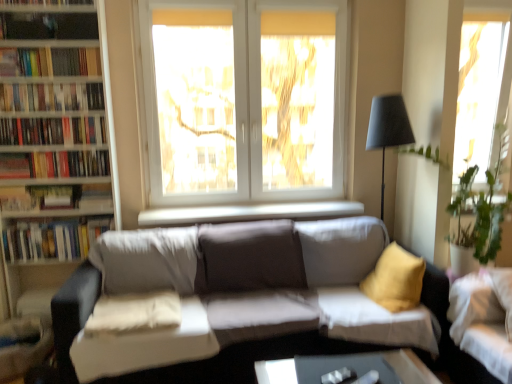
In the scene shown: What is the approximate height of hardcover books at left, which is the fourth book from top to bottom?

The height of hardcover books at left, which is the fourth book from top to bottom, is 7.80 inches.

This screenshot has height=384, width=512. What are the coordinates of `hardcover books at left, positioned as the second book in bottom-to-top order` in the screenshot? It's located at (55, 164).

What do you see at coordinates (237, 305) in the screenshot? I see `light gray fabric couch at center, which appears as the 1th studio couch when viewed from the left` at bounding box center [237, 305].

You are a GUI agent. You are given a task and a screenshot of the screen. Output one action in this format:
    pyautogui.click(x=<x>, y=<y>)
    Task: Click on the light gray fabric couch at center, which appears as the 1th studio couch when viewed from the left
    The width and height of the screenshot is (512, 384).
    Given the screenshot: What is the action you would take?
    pyautogui.click(x=237, y=305)

What do you see at coordinates (52, 151) in the screenshot? I see `white wooden bookcase at left` at bounding box center [52, 151].

Locate an element on the screen. This screenshot has width=512, height=384. hardcover books at left, which is the 2th book in top-to-bottom order is located at coordinates (51, 97).

Find the location of `hardcover books at left, positioned as the second book in bottom-to-top order`. hardcover books at left, positioned as the second book in bottom-to-top order is located at coordinates (55, 164).

Which is further, (213, 210) or (53, 121)?

The point (213, 210) is farther from the camera.

Image resolution: width=512 pixels, height=384 pixels. I want to click on window sill below the hardcover books at left, marked as the 3th book in a top-to-bottom arrangement (from a real-world perspective), so click(x=248, y=213).

Can you confirm if white smooth window sill at center is smaller than hardcover books at left, marked as the 3th book in a top-to-bottom arrangement?

Yes, white smooth window sill at center is smaller than hardcover books at left, marked as the 3th book in a top-to-bottom arrangement.

Is white smooth window sill at center closer to the viewer compared to hardcover books at left, marked as the 3th book in a top-to-bottom arrangement?

No, white smooth window sill at center is further to the viewer.

Which of these two, hardcover books at left, marked as the 3th book in a top-to-bottom arrangement, or hardcover book at left, the 5th book positioned from the top, is wider?

Wider between the two is hardcover book at left, the 5th book positioned from the top.

From the hardcover books at left, marked as the 3th book in a top-to-bottom arrangement, count 2nd books backward and point to it. Please provide its 2D coordinates.

[(52, 239)]

Considering the relative positions of hardcover books at left, the 3th book when ordered from bottom to top, and hardcover book at left, the 5th book positioned from the top, in the image provided, is hardcover books at left, the 3th book when ordered from bottom to top, to the left of hardcover book at left, the 5th book positioned from the top, from the viewer's perspective?

Correct, you'll find hardcover books at left, the 3th book when ordered from bottom to top, to the left of hardcover book at left, the 5th book positioned from the top.

Based on the photo, is hardcover books at left, marked as the 3th book in a top-to-bottom arrangement, positioned with its back to hardcover book at left, the 5th book positioned from the top?

hardcover books at left, marked as the 3th book in a top-to-bottom arrangement, does not have its back to hardcover book at left, the 5th book positioned from the top.

From a real-world perspective, does hardcover books at left, which is the 2th book in top-to-bottom order, stand above white smooth window sill at center?

Yes, from a real-world perspective, hardcover books at left, which is the 2th book in top-to-bottom order, is on top of white smooth window sill at center.

Does hardcover books at left, which is the 2th book in top-to-bottom order, have a greater height compared to white smooth window sill at center?

Indeed, hardcover books at left, which is the 2th book in top-to-bottom order, has a greater height compared to white smooth window sill at center.

How many degrees apart are the facing directions of hardcover books at left, the 4th book positioned from the bottom, and white smooth window sill at center?

hardcover books at left, the 4th book positioned from the bottom, and white smooth window sill at center are facing 1.32 degrees away from each other.

How distant is hardcover books at left, the 4th book positioned from the bottom, from white smooth window sill at center?

hardcover books at left, the 4th book positioned from the bottom, and white smooth window sill at center are 3.74 feet apart.

In the scene shown: Is light gray fabric couch at center, which is counted as the second studio couch, starting from the right, taller or shorter than hardcover book at left, marked as the first book in a bottom-to-top arrangement?

light gray fabric couch at center, which is counted as the second studio couch, starting from the right, is taller than hardcover book at left, marked as the first book in a bottom-to-top arrangement.

How many degrees apart are the facing directions of light gray fabric couch at center, which appears as the 1th studio couch when viewed from the left, and hardcover book at left, the 5th book positioned from the top?

0.681 degrees.

Is light gray fabric couch at center, which is counted as the second studio couch, starting from the right, inside the boundaries of hardcover book at left, the 5th book positioned from the top, or outside?

light gray fabric couch at center, which is counted as the second studio couch, starting from the right, is spatially situated outside hardcover book at left, the 5th book positioned from the top.

From the image's perspective, does light gray fabric couch at center, which is counted as the second studio couch, starting from the right, appear lower than hardcover book at left, the 5th book positioned from the top?

Yes.

Does point (71, 88) lie in front of point (75, 5)?

No, (71, 88) is further to viewer.

Is there a large distance between hardcover books at left, which is the 2th book in top-to-bottom order, and wooden bookshelf at upper left?

No, hardcover books at left, which is the 2th book in top-to-bottom order, is not far away from wooden bookshelf at upper left.

From the image's perspective, which book is the 2nd one below the wooden bookshelf at upper left? Please provide its 2D coordinates.

[(51, 97)]

Based on the photo, from a real-world perspective, which is physically above, hardcover books at left, which is the 2th book in top-to-bottom order, or hardcover books at upper left, the 1th book positioned from the top?

From a 3D spatial view, hardcover books at upper left, the 1th book positioned from the top, is above.

Is hardcover books at left, the 4th book positioned from the bottom, spatially inside hardcover books at upper left, the 1th book positioned from the top, or outside of it?

hardcover books at left, the 4th book positioned from the bottom, lies outside hardcover books at upper left, the 1th book positioned from the top.

The width and height of the screenshot is (512, 384). There is a hardcover books at upper left, the 1th book positioned from the top. What are the coordinates of `the 1st book below it (from the image's perspective)` in the screenshot? It's located at (51, 97).

Who is shorter, hardcover books at left, which is the 2th book in top-to-bottom order, or hardcover books at upper left, the 1th book positioned from the top?

hardcover books at left, which is the 2th book in top-to-bottom order.

Is hardcover book at left, marked as the first book in a bottom-to-top arrangement, facing away from hardcover books at left, the 4th book positioned from the bottom?

No, hardcover book at left, marked as the first book in a bottom-to-top arrangement,'s orientation is not away from hardcover books at left, the 4th book positioned from the bottom.

Identify the location of book that is the 3rd object located in front of the hardcover book at left, marked as the first book in a bottom-to-top arrangement. (51, 97).

Is hardcover books at left, which is the 2th book in top-to-bottom order, a part of hardcover book at left, marked as the first book in a bottom-to-top arrangement?

No, hardcover book at left, marked as the first book in a bottom-to-top arrangement, does not contain hardcover books at left, which is the 2th book in top-to-bottom order.

Considering the relative sizes of hardcover book at left, the 5th book positioned from the top, and hardcover books at left, which is the 2th book in top-to-bottom order, in the image provided, is hardcover book at left, the 5th book positioned from the top, taller than hardcover books at left, which is the 2th book in top-to-bottom order,?

Indeed, hardcover book at left, the 5th book positioned from the top, has a greater height compared to hardcover books at left, which is the 2th book in top-to-bottom order.

From a real-world perspective, starting from the white smooth window sill at center, which book is the 2nd one vertically above it? Please provide its 2D coordinates.

[(52, 131)]

Find the location of a particular element. The image size is (512, 384). the 2nd book positioned below the hardcover books at left, the 3th book when ordered from bottom to top (from a real-world perspective) is located at coordinates (52, 239).

Considering their positions, is white fabric couch at lower right, which is the 1th studio couch from right to left, positioned further to wooden bookshelf at upper left than hardcover books at left, the 4th book positioned from the bottom?

The object further to wooden bookshelf at upper left is white fabric couch at lower right, which is the 1th studio couch from right to left.

Considering their positions, is transparent glass window at upper right, positioned as the second window in left-to-right order, positioned further to matte black table at center than white fabric couch at lower right, placed as the second studio couch when sorted from left to right?

Based on the image, transparent glass window at upper right, positioned as the second window in left-to-right order, appears to be further to matte black table at center.

Looking at the image, which one is located further to hardcover books at left, positioned as the second book in bottom-to-top order, white glass window at center, marked as the 1th window in a left-to-right arrangement, or hardcover books at left, marked as the 3th book in a top-to-bottom arrangement?

white glass window at center, marked as the 1th window in a left-to-right arrangement.

Which object lies nearer to the anchor point white fabric couch at lower right, placed as the second studio couch when sorted from left to right, hardcover book at left, the 5th book positioned from the top, or hardcover books at left, which is the 2th book in top-to-bottom order?

hardcover book at left, the 5th book positioned from the top, lies closer to white fabric couch at lower right, placed as the second studio couch when sorted from left to right, than the other object.

Estimate the real-world distances between objects in this image. Which object is further from wooden bookshelf at upper left, transparent glass window at upper right, positioned as the second window in left-to-right order, or white fabric couch at lower right, which is the 1th studio couch from right to left?

The object further to wooden bookshelf at upper left is transparent glass window at upper right, positioned as the second window in left-to-right order.

Estimate the real-world distances between objects in this image. Which object is closer to white fabric couch at lower right, placed as the second studio couch when sorted from left to right, light gray fabric couch at center, which is counted as the second studio couch, starting from the right, or white glass window at center, marked as the 1th window in a left-to-right arrangement?

Among the two, light gray fabric couch at center, which is counted as the second studio couch, starting from the right, is located nearer to white fabric couch at lower right, placed as the second studio couch when sorted from left to right.

Looking at this image, considering their positions, is matte black table at center positioned further to transparent glass window at upper right, the first window when ordered from right to left, than white glass window at center, arranged as the 2th window when viewed from the right?

matte black table at center lies further to transparent glass window at upper right, the first window when ordered from right to left, than the other object.

Considering their positions, is white glass window at center, arranged as the 2th window when viewed from the right, positioned further to transparent glass window at upper right, the first window when ordered from right to left, than hardcover book at left, marked as the first book in a bottom-to-top arrangement?

hardcover book at left, marked as the first book in a bottom-to-top arrangement.

The width and height of the screenshot is (512, 384). Find the location of `book between hardcover books at left, the 4th book positioned from the bottom, and white wooden bookcase at left in the up-down direction`. book between hardcover books at left, the 4th book positioned from the bottom, and white wooden bookcase at left in the up-down direction is located at coordinates (52, 131).

Locate an element on the screen. This screenshot has width=512, height=384. shelf between hardcover books at left, the 4th book positioned from the bottom, and white fabric couch at lower right, which is the 1th studio couch from right to left, from left to right is located at coordinates (48, 5).

Find the location of a particular element. studio couch between hardcover books at left, the 3th book when ordered from bottom to top, and matte black table at center from left to right is located at coordinates (237, 305).

Find the location of a particular element. window between white wooden bookcase at left and matte black table at center in the horizontal direction is located at coordinates (244, 99).